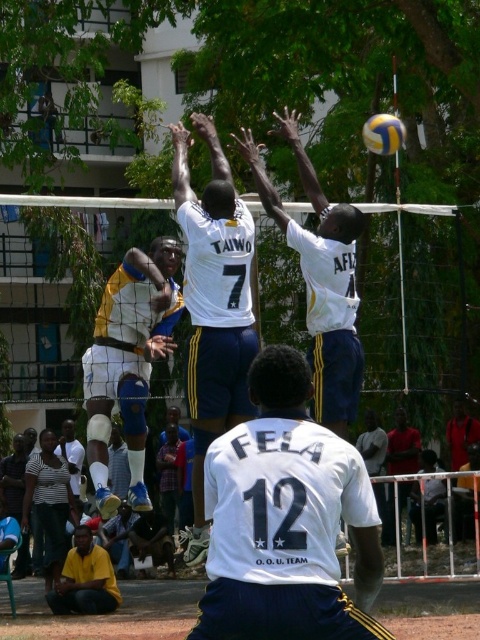
You are a photographer trying to capture a volleyball game. You notice two players in the image, one wearing a yellow and blue uniform at center and the other in a dark red shirt at lower right. Based on their positions, which player is closer to the camera?

The dark red shirt at lower right is closer to the camera because it appears smaller than the yellow and blue uniform at center, which is taller in the image.

You are a spectator standing at the point labeled as point [225,156]. You want to throw a water bottle to your friend who is 26.34 meters away from you. Can you estimate if your throw will reach them?

The distance between you and your friend is exactly 26.34 meters, which is the same as the distance from point [225,156] to the viewer. If your throw can cover 26.34 meters, then yes, it will reach them.